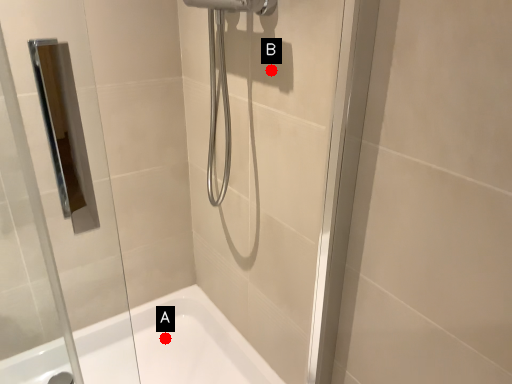
Question: Two points are circled on the image, labeled by A and B beside each circle. Which of the following is the farthest from the observer?

Choices:
 (A) A is further
 (B) B is further

Answer: (A)